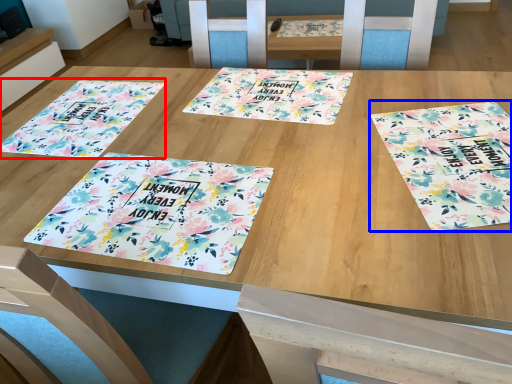
Question: Which object appears farthest to the camera in this image, tablecloth (highlighted by a red box) or tablecloth (highlighted by a blue box)?

Choices:
 (A) tablecloth
 (B) tablecloth

Answer: (A)